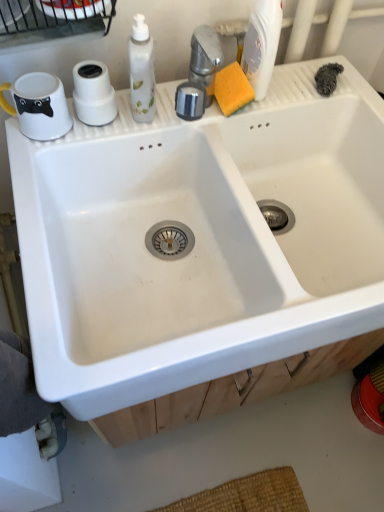
Locate an element on the screen. vacant area that lies to the right of white matte toilet paper at upper left is located at coordinates (150, 119).